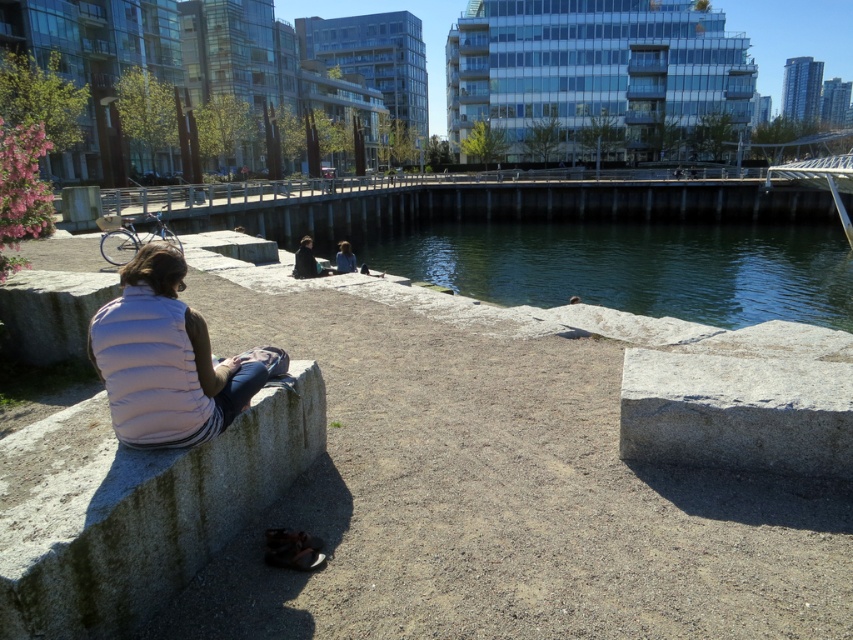
Between dark brown leather jacket at center and light brown hair at center, which one appears on the right side from the viewer's perspective?

light brown hair at center

Is dark brown leather jacket at center taller than light brown hair at center?

Incorrect, dark brown leather jacket at center's height is not larger of light brown hair at center's.

Locate an element on the screen. dark brown leather jacket at center is located at coordinates (306, 260).

Does white puffy vest at left have a greater width compared to dark brown leather jacket at center?

No.

Is white puffy vest at left thinner than dark brown leather jacket at center?

Indeed, white puffy vest at left has a lesser width compared to dark brown leather jacket at center.

Is point (129, 356) positioned in front of point (300, 240)?

Yes, it is in front of point (300, 240).

This screenshot has width=853, height=640. In order to click on white puffy vest at left in this screenshot , I will do `click(163, 358)`.

Does gray granite concrete at lower left have a larger size compared to light brown hair at center?

Actually, gray granite concrete at lower left might be smaller than light brown hair at center.

This screenshot has height=640, width=853. What are the coordinates of `gray granite concrete at lower left` in the screenshot? It's located at (134, 508).

Image resolution: width=853 pixels, height=640 pixels. Find the location of `gray granite concrete at lower left`. gray granite concrete at lower left is located at coordinates (134, 508).